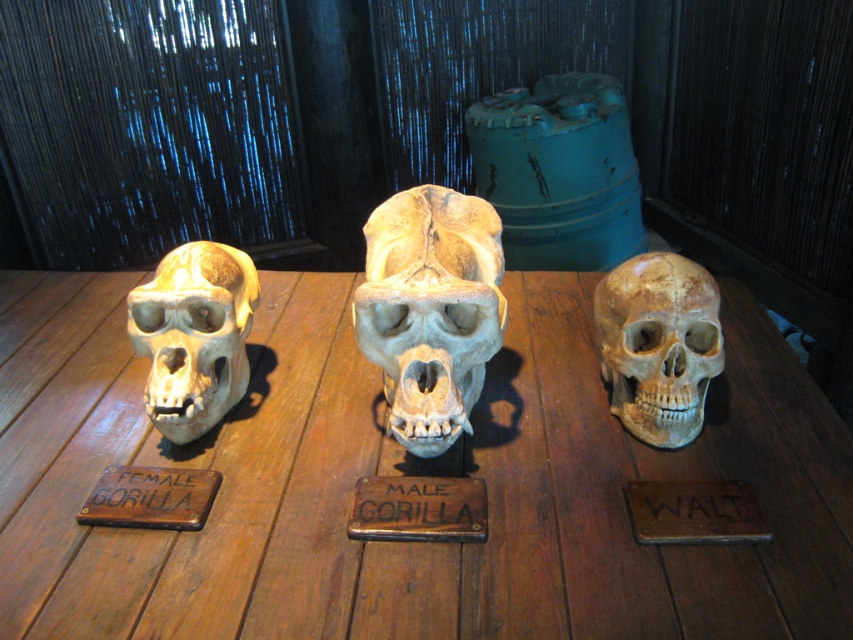
You are an anthropologist examining the skulls on the wooden table. The matte beige skull at center is part of your study. Based on its position, can you determine if it is closer to the left or right edge of the table?

The matte beige skull at center is located at coordinates approximately 0.539 along the horizontal axis and 0.773 vertically. Since the horizontal coordinate is closer to 0.5, which is the center point, it is equidistant from both the left and right edges of the table.

You are standing in a room with a wooden table at center. A small wooden plaque with a skull is placed on the table. If you want to place another plaque on the table, where should you put it?

You should place the new plaque on the wooden table at center since it is the central location in the scene and has space available for additional items.

You are an anthropologist examining the skulls on the wooden table. You need to determine which object is bigger between the matte bone skull at center and the brown wood plaque at lower left. Which one is larger?

The matte bone skull at center has a larger size compared to the brown wood plaque at lower left, so the matte bone skull at center is larger.